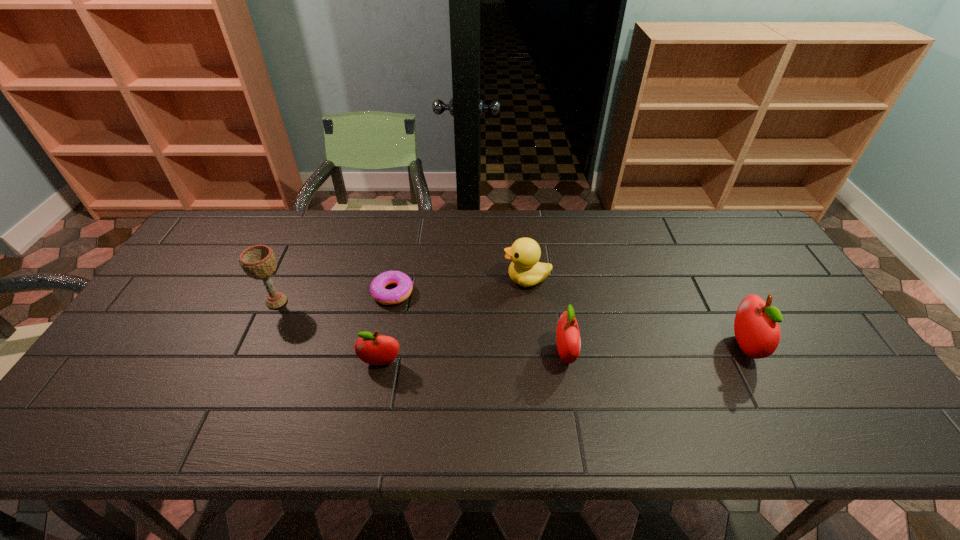
You are a GUI agent. You are given a task and a screenshot of the screen. Output one action in this format:
    pyautogui.click(x=<x>, y=<y>)
    Task: Click on the apple that stands as the third closest to the chalice
    Image resolution: width=960 pixels, height=540 pixels.
    Given the screenshot: What is the action you would take?
    pyautogui.click(x=756, y=328)

I want to click on apple that is the third closest one to the duck, so 756,328.

The width and height of the screenshot is (960, 540). Find the location of `vacant space that satisfies the following two spatial constraints: 1. on the face of the duck; 2. on the right side of the rightmost apple`. vacant space that satisfies the following two spatial constraints: 1. on the face of the duck; 2. on the right side of the rightmost apple is located at coordinates (534, 346).

In order to click on vacant position in the image that satisfies the following two spatial constraints: 1. on the face of the duck; 2. on the back side of the second apple from right to left in this screenshot , I will do `click(535, 354)`.

Locate an element on the screen. free space that satisfies the following two spatial constraints: 1. on the front side of the second tallest apple; 2. on the right side of the chalice is located at coordinates (253, 354).